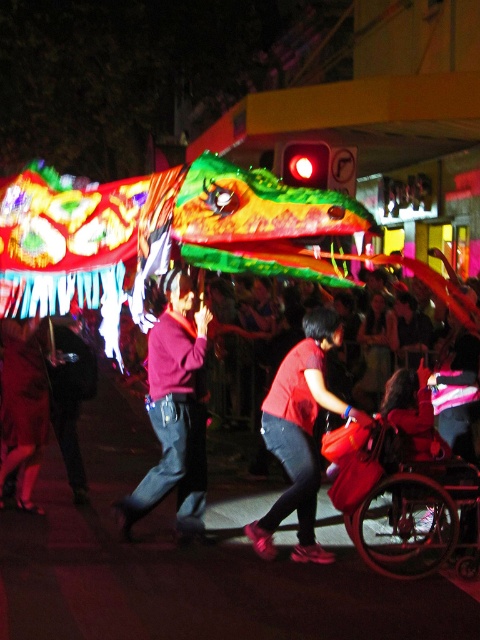
Does matte red sweater at center lie in front of metallic red wheelchair at lower right?

No, matte red sweater at center is behind metallic red wheelchair at lower right.

Where is `matte red sweater at center`? The height and width of the screenshot is (640, 480). matte red sweater at center is located at coordinates (173, 412).

The image size is (480, 640). I want to click on matte red sweater at center, so click(173, 412).

Is matte red sweater at center to the right of matte red shirt at center from the viewer's perspective?

No, matte red sweater at center is not to the right of matte red shirt at center.

The height and width of the screenshot is (640, 480). What do you see at coordinates (173, 412) in the screenshot?
I see `matte red sweater at center` at bounding box center [173, 412].

Does point (168, 416) lie in front of point (384, 323)?

Yes, point (168, 416) is closer to viewer.

At what (x,y) coordinates should I click in order to perform the action: click on matte red sweater at center. Please return your answer as a coordinate pair (x, y). This screenshot has width=480, height=640. Looking at the image, I should click on (173, 412).

Who is positioned more to the left, metallic red wheelchair at lower right or matte red shirt at center?

Positioned to the left is metallic red wheelchair at lower right.

Locate an element on the screen. This screenshot has width=480, height=640. metallic red wheelchair at lower right is located at coordinates (406, 513).

Describe the element at coordinates (406, 513) in the screenshot. I see `metallic red wheelchair at lower right` at that location.

Find the location of `metallic red wheelchair at lower right`. metallic red wheelchair at lower right is located at coordinates (406, 513).